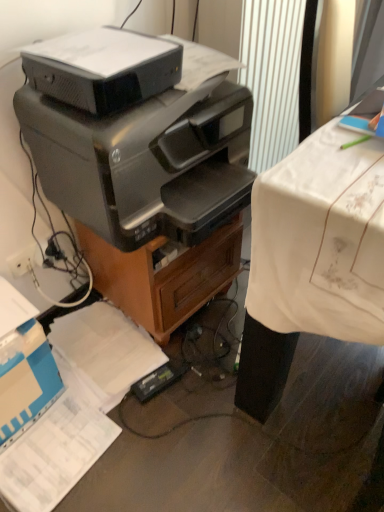
Measure the distance between satin black printer at upper center, acting as the 2th printer starting from the bottom, and camera.

The depth of satin black printer at upper center, acting as the 2th printer starting from the bottom, is 28.96 inches.

What do you see at coordinates (164, 276) in the screenshot? I see `metallic brown file cabinet at center` at bounding box center [164, 276].

Measure the distance between white plastic plug at lower left and camera.

white plastic plug at lower left and camera are 3.96 feet apart.

Locate an element on the screen. black glossy printer at center, placed as the first printer when sorted from bottom to top is located at coordinates (148, 155).

Where is `satin black printer at upper center, which ranks as the first printer in top-to-bottom order`? satin black printer at upper center, which ranks as the first printer in top-to-bottom order is located at coordinates (103, 68).

Who is shorter, blue cardboard box at lower left or white plastic plug at lower left?

white plastic plug at lower left.

Which is correct: blue cardboard box at lower left is inside white plastic plug at lower left, or outside of it?

blue cardboard box at lower left is not enclosed by white plastic plug at lower left.

Does blue cardboard box at lower left turn towards white plastic plug at lower left?

No, blue cardboard box at lower left is not facing towards white plastic plug at lower left.

From a real-world perspective, between blue cardboard box at lower left and white plastic plug at lower left, who is vertically higher?

white plastic plug at lower left.

Is white plastic plug at lower left bigger than blue cardboard box at lower left?

No, white plastic plug at lower left is not bigger than blue cardboard box at lower left.

Looking at this image, would you say white plastic plug at lower left is a long distance from blue cardboard box at lower left?

white plastic plug at lower left is near blue cardboard box at lower left, not far away.

From the image's perspective, which one is positioned lower, white plastic plug at lower left or blue cardboard box at lower left?

blue cardboard box at lower left.

Is white plastic plug at lower left not near black glossy printer at center, the 2th printer viewed from the top?

That's not correct — white plastic plug at lower left is a little close to black glossy printer at center, the 2th printer viewed from the top.

Considering the sizes of objects white plastic plug at lower left and black glossy printer at center, the 2th printer viewed from the top, in the image provided, who is bigger, white plastic plug at lower left or black glossy printer at center, the 2th printer viewed from the top,?

black glossy printer at center, the 2th printer viewed from the top, is bigger.

Is black glossy printer at center, the 2th printer viewed from the top, completely or partially inside white plastic plug at lower left?

No.

Which of these two, white plastic plug at lower left or black glossy printer at center, the 2th printer viewed from the top, is wider?

Wider between the two is black glossy printer at center, the 2th printer viewed from the top.

Is black glossy printer at center, placed as the first printer when sorted from bottom to top, not within white plastic plug at lower left?

black glossy printer at center, placed as the first printer when sorted from bottom to top, lies outside white plastic plug at lower left's area.

Could you tell me if black glossy printer at center, placed as the first printer when sorted from bottom to top, is turned towards white plastic plug at lower left?

No, black glossy printer at center, placed as the first printer when sorted from bottom to top, is not turned towards white plastic plug at lower left.

Is black glossy printer at center, placed as the first printer when sorted from bottom to top, in contact with white plastic plug at lower left?

black glossy printer at center, placed as the first printer when sorted from bottom to top, and white plastic plug at lower left are clearly separated.

From the image's perspective, who appears lower, black glossy printer at center, the 2th printer viewed from the top, or white plastic plug at lower left?

white plastic plug at lower left is shown below in the image.

Is white cloth-covered desk at right at the back of white plastic plug at lower left?

white plastic plug at lower left is not turned away from white cloth-covered desk at right.

From the picture: Is white plastic plug at lower left not close to white cloth-covered desk at right?

No, white plastic plug at lower left is not far from white cloth-covered desk at right.

Can white cloth-covered desk at right be found inside white plastic plug at lower left?

No.

Considering the relative sizes of white plastic plug at lower left and white cloth-covered desk at right in the image provided, is white plastic plug at lower left smaller than white cloth-covered desk at right?

Yes, white plastic plug at lower left is smaller than white cloth-covered desk at right.

Does satin black printer at upper center, which ranks as the first printer in top-to-bottom order, have a greater width compared to white plastic plug at lower left?

Correct, the width of satin black printer at upper center, which ranks as the first printer in top-to-bottom order, exceeds that of white plastic plug at lower left.

From a real-world perspective, is satin black printer at upper center, which ranks as the first printer in top-to-bottom order, above or below white plastic plug at lower left?

From a real-world perspective, satin black printer at upper center, which ranks as the first printer in top-to-bottom order, is physically above white plastic plug at lower left.

Considering the relative sizes of satin black printer at upper center, which ranks as the first printer in top-to-bottom order, and white plastic plug at lower left in the image provided, is satin black printer at upper center, which ranks as the first printer in top-to-bottom order, shorter than white plastic plug at lower left?

In fact, satin black printer at upper center, which ranks as the first printer in top-to-bottom order, may be taller than white plastic plug at lower left.

Is satin black printer at upper center, acting as the 2th printer starting from the bottom, beside white plastic plug at lower left?

No, satin black printer at upper center, acting as the 2th printer starting from the bottom, is not in contact with white plastic plug at lower left.

In the scene shown: Which is more to the left, white plastic plug at lower left or metallic brown file cabinet at center?

white plastic plug at lower left.

From the image's perspective, is white plastic plug at lower left on metallic brown file cabinet at center?

Incorrect, from the image's perspective, white plastic plug at lower left is lower than metallic brown file cabinet at center.

Considering the relative sizes of white plastic plug at lower left and metallic brown file cabinet at center in the image provided, is white plastic plug at lower left taller than metallic brown file cabinet at center?

No, white plastic plug at lower left is not taller than metallic brown file cabinet at center.

Where is `cardboard box that is in front of the white plastic plug at lower left`? This screenshot has width=384, height=512. cardboard box that is in front of the white plastic plug at lower left is located at coordinates (23, 366).

Identify the location of plug that appears on the right of blue cardboard box at lower left. The height and width of the screenshot is (512, 384). (24, 260).

Based on their spatial positions, is metallic brown file cabinet at center or satin black printer at upper center, acting as the 2th printer starting from the bottom, closer to white plastic plug at lower left?

metallic brown file cabinet at center is closer to white plastic plug at lower left.

Which object lies further to the anchor point satin black printer at upper center, acting as the 2th printer starting from the bottom, white cloth-covered desk at right or white plastic plug at lower left?

white plastic plug at lower left is positioned further to the anchor satin black printer at upper center, acting as the 2th printer starting from the bottom.

Considering their positions, is blue cardboard box at lower left positioned closer to satin black printer at upper center, acting as the 2th printer starting from the bottom, than metallic brown file cabinet at center?

Among the two, metallic brown file cabinet at center is located nearer to satin black printer at upper center, acting as the 2th printer starting from the bottom.

Estimate the real-world distances between objects in this image. Which object is closer to metallic brown file cabinet at center, black glossy printer at center, placed as the first printer when sorted from bottom to top, or white plastic plug at lower left?

Based on the image, black glossy printer at center, placed as the first printer when sorted from bottom to top, appears to be nearer to metallic brown file cabinet at center.

From the image, which object appears to be farther from satin black printer at upper center, which ranks as the first printer in top-to-bottom order, white cloth-covered desk at right or black glossy printer at center, placed as the first printer when sorted from bottom to top?

white cloth-covered desk at right lies further to satin black printer at upper center, which ranks as the first printer in top-to-bottom order, than the other object.

When comparing their distances from white cloth-covered desk at right, does black glossy printer at center, placed as the first printer when sorted from bottom to top, or metallic brown file cabinet at center seem closer?

black glossy printer at center, placed as the first printer when sorted from bottom to top, is closer to white cloth-covered desk at right.

Which object lies nearer to the anchor point white cloth-covered desk at right, white plastic plug at lower left or black glossy printer at center, the 2th printer viewed from the top?

black glossy printer at center, the 2th printer viewed from the top, is positioned closer to the anchor white cloth-covered desk at right.

Considering their positions, is white cloth-covered desk at right positioned further to white plastic plug at lower left than blue cardboard box at lower left?

white cloth-covered desk at right.

Where is `file cabinet that lies between satin black printer at upper center, which ranks as the first printer in top-to-bottom order, and blue cardboard box at lower left from top to bottom`? Image resolution: width=384 pixels, height=512 pixels. file cabinet that lies between satin black printer at upper center, which ranks as the first printer in top-to-bottom order, and blue cardboard box at lower left from top to bottom is located at coordinates (164, 276).

This screenshot has height=512, width=384. Identify the location of file cabinet located between white plastic plug at lower left and white cloth-covered desk at right in the left-right direction. (164, 276).

Locate an element on the screen. printer located between satin black printer at upper center, acting as the 2th printer starting from the bottom, and white cloth-covered desk at right in the left-right direction is located at coordinates (148, 155).

Find the location of a particular element. The image size is (384, 512). file cabinet between blue cardboard box at lower left and white cloth-covered desk at right from left to right is located at coordinates (164, 276).